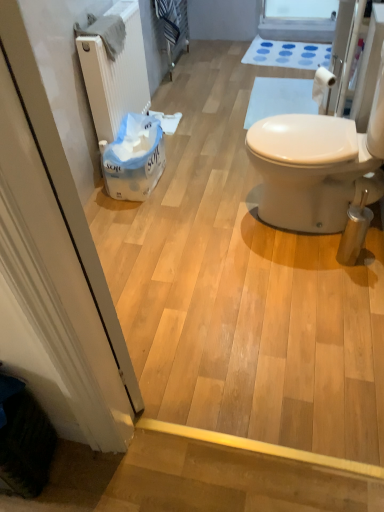
Locate an element on the screen. The image size is (384, 512). free space to the right of white matte screen door at left is located at coordinates (174, 362).